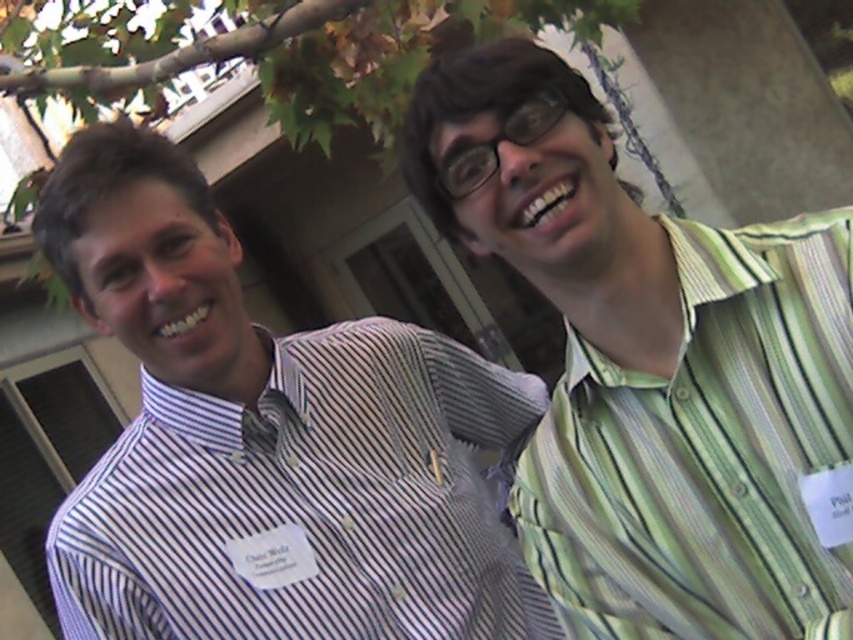
You are a photographer trying to capture a closeup of the green striped shirt at right. The camera you are using has a focal length of 50mm. To ensure the subject fills the frame, you need to position yourself at a distance where the shirt occupies 80 percent of the frame height. Given that the shirt is located at coordinates point 0.577, 0.768, can you determine if the shirt is positioned high enough in the frame for this requirement?

The green striped shirt at right is located at point (654, 369). Since the y coordinate 0.768 indicates it is positioned high enough in the frame, the shirt can occupy 80 percent of the frame height when captured with a 50mm lens.